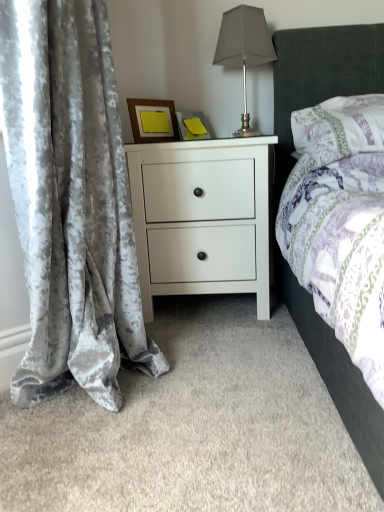
What do you see at coordinates (152, 111) in the screenshot? I see `wooden frame at upper center` at bounding box center [152, 111].

Where is `velvet gray curtain at left`? The height and width of the screenshot is (512, 384). velvet gray curtain at left is located at coordinates (71, 202).

Are wooden frame at upper center and patterned fabric pillow at upper right located far from each other?

wooden frame at upper center is near patterned fabric pillow at upper right, not far away.

Could you tell me if wooden frame at upper center is facing patterned fabric pillow at upper right?

Yes.

Considering the positions of points (135, 141) and (296, 138), is point (135, 141) farther from camera compared to point (296, 138)?

No, it is in front of (296, 138).

Considering the relative positions of wooden frame at upper center and patterned fabric pillow at upper right in the image provided, is wooden frame at upper center to the left of patterned fabric pillow at upper right from the viewer's perspective?

Correct, you'll find wooden frame at upper center to the left of patterned fabric pillow at upper right.

From the image's perspective, would you say velvet gray curtain at left is shown under satin silver table lamp at upper right?

Indeed, from the image's perspective, velvet gray curtain at left is shown beneath satin silver table lamp at upper right.

In the scene shown: Considering the relative sizes of velvet gray curtain at left and satin silver table lamp at upper right in the image provided, is velvet gray curtain at left wider than satin silver table lamp at upper right?

Yes.

Is velvet gray curtain at left bigger or smaller than satin silver table lamp at upper right?

Considering their sizes, velvet gray curtain at left takes up more space than satin silver table lamp at upper right.

From a real-world perspective, is wooden frame at upper center beneath white matte nightstand at center?

No, from a real-world perspective, wooden frame at upper center is not below white matte nightstand at center.

Is wooden frame at upper center completely or partially outside of white matte nightstand at center?

Yes, wooden frame at upper center is outside of white matte nightstand at center.

From the image's perspective, which one is positioned higher, wooden frame at upper center or white matte nightstand at center?

wooden frame at upper center is shown above in the image.

Between wooden frame at upper center and white matte nightstand at center, which one is positioned in front?

white matte nightstand at center.

From a real-world perspective, is white matte nightstand at center above or below satin silver table lamp at upper right?

white matte nightstand at center is below satin silver table lamp at upper right.

How different are the orientations of white matte nightstand at center and satin silver table lamp at upper right in degrees?

9.13e-05 degrees.

Would you say white matte nightstand at center is outside satin silver table lamp at upper right?

Yes, white matte nightstand at center is located beyond the bounds of satin silver table lamp at upper right.

Considering the positions of objects white matte nightstand at center and satin silver table lamp at upper right in the image provided, who is behind, white matte nightstand at center or satin silver table lamp at upper right?

satin silver table lamp at upper right is further away from the camera.

Can you confirm if satin silver table lamp at upper right is thinner than velvet gray curtain at left?

Correct, the width of satin silver table lamp at upper right is less than that of velvet gray curtain at left.

Is velvet gray curtain at left at the back of satin silver table lamp at upper right?

No, satin silver table lamp at upper right is not facing the opposite direction of velvet gray curtain at left.

Is satin silver table lamp at upper right shorter than velvet gray curtain at left?

Indeed, satin silver table lamp at upper right has a lesser height compared to velvet gray curtain at left.

What's the angular difference between satin silver table lamp at upper right and velvet gray curtain at left's facing directions?

91.6 degrees separate the facing orientations of satin silver table lamp at upper right and velvet gray curtain at left.

Can you confirm if patterned fabric pillow at upper right is wider than satin silver table lamp at upper right?

Yes, patterned fabric pillow at upper right is wider than satin silver table lamp at upper right.

Is patterned fabric pillow at upper right to the left of satin silver table lamp at upper right from the viewer's perspective?

No, patterned fabric pillow at upper right is not to the left of satin silver table lamp at upper right.

Between point (315, 123) and point (245, 65), which one is positioned in front?

The point (315, 123) is in front.

Find the location of a particular element. The height and width of the screenshot is (512, 384). picture frame above the velvet gray curtain at left (from the image's perspective) is located at coordinates (152, 111).

Considering the relative positions of velvet gray curtain at left and wooden frame at upper center in the image provided, is velvet gray curtain at left to the left of wooden frame at upper center from the viewer's perspective?

Yes.

Which object is closer to the camera taking this photo, velvet gray curtain at left or wooden frame at upper center?

Positioned in front is velvet gray curtain at left.

Looking at their sizes, would you say velvet gray curtain at left is wider or thinner than wooden frame at upper center?

Considering their sizes, velvet gray curtain at left looks broader than wooden frame at upper center.

The height and width of the screenshot is (512, 384). In order to click on pillow that is below the wooden frame at upper center (from the image's perspective) in this screenshot , I will do `click(339, 128)`.

You are a GUI agent. You are given a task and a screenshot of the screen. Output one action in this format:
    pyautogui.click(x=<x>, y=<y>)
    Task: Click on the curtain directly beneath the satin silver table lamp at upper right (from a real-world perspective)
    The image size is (384, 512).
    Given the screenshot: What is the action you would take?
    pyautogui.click(x=71, y=202)

Looking at this image, looking at the image, which one is located further to patterned fabric pillow at upper right, satin silver table lamp at upper right or white matte nightstand at center?

white matte nightstand at center is further to patterned fabric pillow at upper right.

Based on the photo, from the image, which object appears to be nearer to white matte nightstand at center, satin silver table lamp at upper right or patterned fabric pillow at upper right?

The object closer to white matte nightstand at center is patterned fabric pillow at upper right.

Based on the photo, based on their spatial positions, is patterned fabric pillow at upper right or white matte nightstand at center closer to velvet gray curtain at left?

The object closer to velvet gray curtain at left is white matte nightstand at center.

When comparing their distances from patterned fabric pillow at upper right, does satin silver table lamp at upper right or velvet gray curtain at left seem further?

velvet gray curtain at left.

Based on their spatial positions, is velvet gray curtain at left or white matte nightstand at center further from patterned fabric pillow at upper right?

velvet gray curtain at left is further to patterned fabric pillow at upper right.

From the picture: Which object lies nearer to the anchor point white matte nightstand at center, patterned fabric pillow at upper right or satin silver table lamp at upper right?

patterned fabric pillow at upper right is closer to white matte nightstand at center.

Which object lies nearer to the anchor point velvet gray curtain at left, patterned fabric pillow at upper right or wooden frame at upper center?

wooden frame at upper center lies closer to velvet gray curtain at left than the other object.

Considering their positions, is wooden frame at upper center positioned closer to white matte nightstand at center than satin silver table lamp at upper right?

The object closer to white matte nightstand at center is wooden frame at upper center.

At what (x,y) coordinates should I click in order to perform the action: click on picture frame located between velvet gray curtain at left and patterned fabric pillow at upper right in the left-right direction. Please return your answer as a coordinate pair (x, y). Image resolution: width=384 pixels, height=512 pixels. Looking at the image, I should click on (152, 111).

Locate an element on the screen. Image resolution: width=384 pixels, height=512 pixels. nightstand between velvet gray curtain at left and patterned fabric pillow at upper right is located at coordinates (202, 219).

You are a GUI agent. You are given a task and a screenshot of the screen. Output one action in this format:
    pyautogui.click(x=<x>, y=<y>)
    Task: Click on the table lamp located between velvet gray curtain at left and patterned fabric pillow at upper right in the left-right direction
    Image resolution: width=384 pixels, height=512 pixels.
    Given the screenshot: What is the action you would take?
    pyautogui.click(x=244, y=49)

In order to click on nightstand between velvet gray curtain at left and wooden frame at upper center in the front-back direction in this screenshot , I will do `click(202, 219)`.